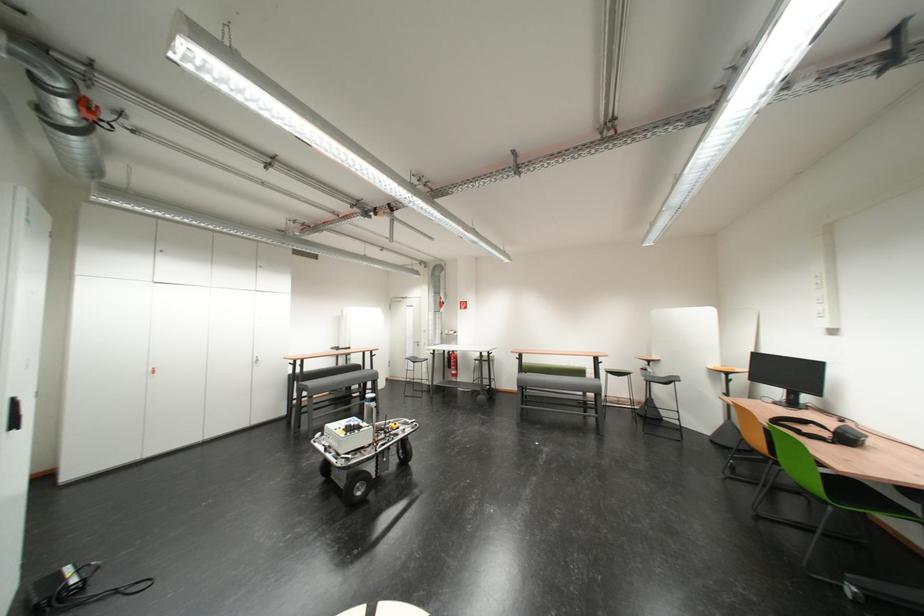
Find where to lift the clear water bottle. Please return your answer as a coordinate pair (x, y).

(370, 408)